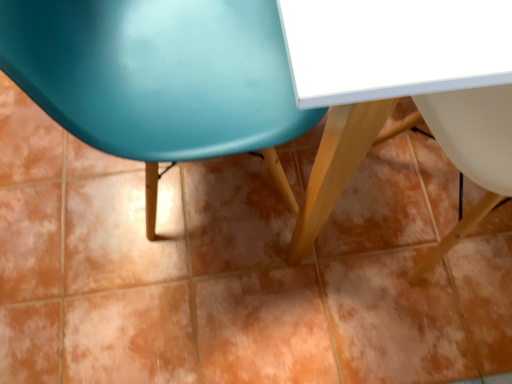
Find the location of a particular element. The image size is (512, 384). matte plastic chair at upper left is located at coordinates (156, 74).

What do you see at coordinates (156, 74) in the screenshot?
I see `matte plastic chair at upper left` at bounding box center [156, 74].

Where is `white glossy table at center`? white glossy table at center is located at coordinates coord(399,85).

Describe the element at coordinates (399, 85) in the screenshot. I see `white glossy table at center` at that location.

Identify the location of matte plastic chair at upper left. (156, 74).

Between white glossy table at center and matte plastic chair at upper left, which one appears on the right side from the viewer's perspective?

Positioned to the right is white glossy table at center.

In the scene shown: Is white glossy table at center in front of matte plastic chair at upper left?

Yes, white glossy table at center is closer to the viewer.

Considering the positions of point (313, 53) and point (1, 38), is point (313, 53) closer or farther from the camera than point (1, 38)?

Point (313, 53) is positioned closer to the camera compared to point (1, 38).

From the image's perspective, between white glossy table at center and matte plastic chair at upper left, who is located below?

matte plastic chair at upper left is shown below in the image.

From a real-world perspective, who is located higher, white glossy table at center or matte plastic chair at upper left?

From a 3D spatial view, matte plastic chair at upper left is above.

Considering the relative sizes of white glossy table at center and matte plastic chair at upper left in the image provided, is white glossy table at center thinner than matte plastic chair at upper left?

Incorrect, the width of white glossy table at center is not less than that of matte plastic chair at upper left.

Is white glossy table at center taller or shorter than matte plastic chair at upper left?

Clearly, white glossy table at center is shorter compared to matte plastic chair at upper left.

Who is smaller, white glossy table at center or matte plastic chair at upper left?

Smaller between the two is matte plastic chair at upper left.

Choose the correct answer: Is white glossy table at center inside matte plastic chair at upper left or outside it?

white glossy table at center is not inside matte plastic chair at upper left, it's outside.

Is the surface of white glossy table at center in direct contact with matte plastic chair at upper left?

white glossy table at center is not next to matte plastic chair at upper left, and they're not touching.

Is white glossy table at center oriented away from matte plastic chair at upper left?

Yes.

How different are the orientations of white glossy table at center and matte plastic chair at upper left in degrees?

0.446 degrees separate the facing orientations of white glossy table at center and matte plastic chair at upper left.

Where is `table on the right of matte plastic chair at upper left`? This screenshot has width=512, height=384. table on the right of matte plastic chair at upper left is located at coordinates (399, 85).

Based on their positions, is matte plastic chair at upper left located to the left or right of white glossy table at center?

In the image, matte plastic chair at upper left appears on the left side of white glossy table at center.

Looking at this image, considering the positions of objects matte plastic chair at upper left and white glossy table at center in the image provided, who is in front, matte plastic chair at upper left or white glossy table at center?

Positioned in front is white glossy table at center.

Is point (4, 8) in front of point (502, 172)?

Yes, it is.

From the image's perspective, does matte plastic chair at upper left appear higher than white glossy table at center?

No, from the image's perspective, matte plastic chair at upper left is not on top of white glossy table at center.

From a real-world perspective, relative to white glossy table at center, is matte plastic chair at upper left vertically above or below?

matte plastic chair at upper left is above white glossy table at center.

Considering the sizes of objects matte plastic chair at upper left and white glossy table at center in the image provided, who is thinner, matte plastic chair at upper left or white glossy table at center?

matte plastic chair at upper left.

Considering the relative sizes of matte plastic chair at upper left and white glossy table at center in the image provided, is matte plastic chair at upper left taller than white glossy table at center?

Correct, matte plastic chair at upper left is much taller as white glossy table at center.

From the picture: Between matte plastic chair at upper left and white glossy table at center, which one has larger size?

Bigger between the two is white glossy table at center.

Is matte plastic chair at upper left inside or outside of white glossy table at center?

matte plastic chair at upper left is located beyond the bounds of white glossy table at center.

Is there a large distance between matte plastic chair at upper left and white glossy table at center?

No, matte plastic chair at upper left is in close proximity to white glossy table at center.

Is matte plastic chair at upper left oriented away from white glossy table at center?

matte plastic chair at upper left is not turned away from white glossy table at center.

Can you tell me how much matte plastic chair at upper left and white glossy table at center differ in facing direction?

The facing directions of matte plastic chair at upper left and white glossy table at center are 0.446 degrees apart.

Find the location of a particular element. The width and height of the screenshot is (512, 384). chair below the white glossy table at center (from the image's perspective) is located at coordinates (156, 74).

Where is `chair located behind the white glossy table at center`? The height and width of the screenshot is (384, 512). chair located behind the white glossy table at center is located at coordinates (156, 74).

This screenshot has height=384, width=512. Identify the location of table in front of the matte plastic chair at upper left. (399, 85).